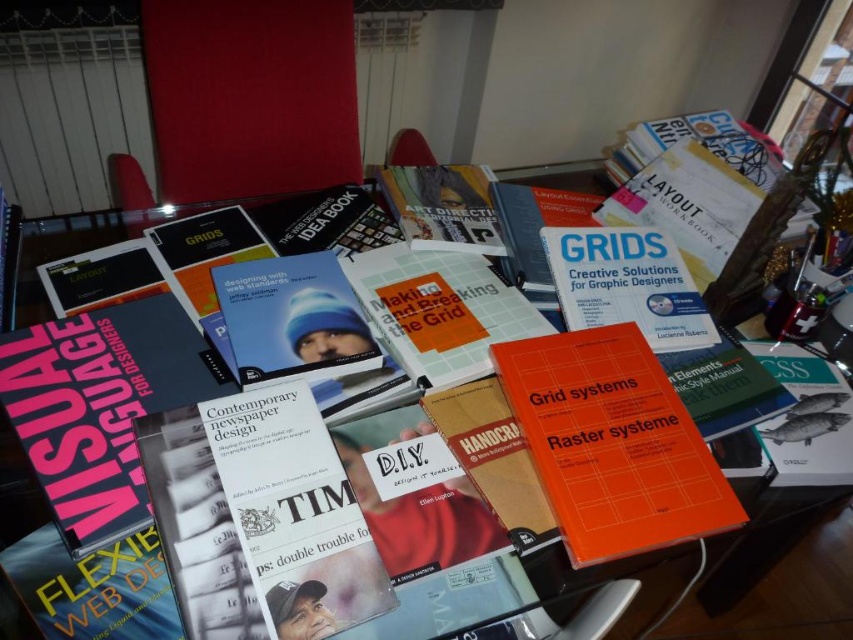
Which is in front, point (608, 364) or point (669, 624)?

Point (608, 364)

Is orange matte book at center wider than transparent glass table at center?

No, orange matte book at center is not wider than transparent glass table at center.

Does point (665, 461) come farther from viewer compared to point (787, 620)?

No, it is not.

Where is `orange matte book at center`? The height and width of the screenshot is (640, 853). orange matte book at center is located at coordinates (612, 444).